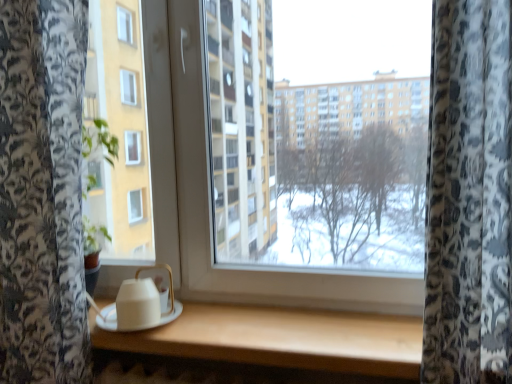
Question: Is white matte table at center wider than white matte teapot at lower left?

Choices:
 (A) no
 (B) yes

Answer: (B)

Question: Is white matte table at center surrounding white matte teapot at lower left?

Choices:
 (A) no
 (B) yes

Answer: (A)

Question: Are white matte table at center and white matte teapot at lower left beside each other?

Choices:
 (A) yes
 (B) no

Answer: (B)

Question: Is white matte table at center shorter than white matte teapot at lower left?

Choices:
 (A) yes
 (B) no

Answer: (A)

Question: Considering the relative positions of white matte table at center and white matte teapot at lower left in the image provided, is white matte table at center to the right of white matte teapot at lower left from the viewer's perspective?

Choices:
 (A) no
 (B) yes

Answer: (B)

Question: From a real-world perspective, is white matte table at center below white matte teapot at lower left?

Choices:
 (A) no
 (B) yes

Answer: (B)

Question: Is white matte teapot at lower left behind white matte table at center?

Choices:
 (A) no
 (B) yes

Answer: (B)

Question: Considering the relative sizes of white matte teapot at lower left and white matte table at center in the image provided, is white matte teapot at lower left bigger than white matte table at center?

Choices:
 (A) no
 (B) yes

Answer: (A)

Question: Does white matte teapot at lower left have a greater height compared to white matte table at center?

Choices:
 (A) no
 (B) yes

Answer: (B)

Question: Can we say white matte teapot at lower left lies outside white matte table at center?

Choices:
 (A) yes
 (B) no

Answer: (A)

Question: Is white matte teapot at lower left shorter than white matte table at center?

Choices:
 (A) yes
 (B) no

Answer: (B)

Question: Is white matte teapot at lower left surrounding white matte table at center?

Choices:
 (A) yes
 (B) no

Answer: (B)

Question: Choose the correct answer: Is white matte table at center inside white matte teapot at lower left or outside it?

Choices:
 (A) outside
 (B) inside

Answer: (A)